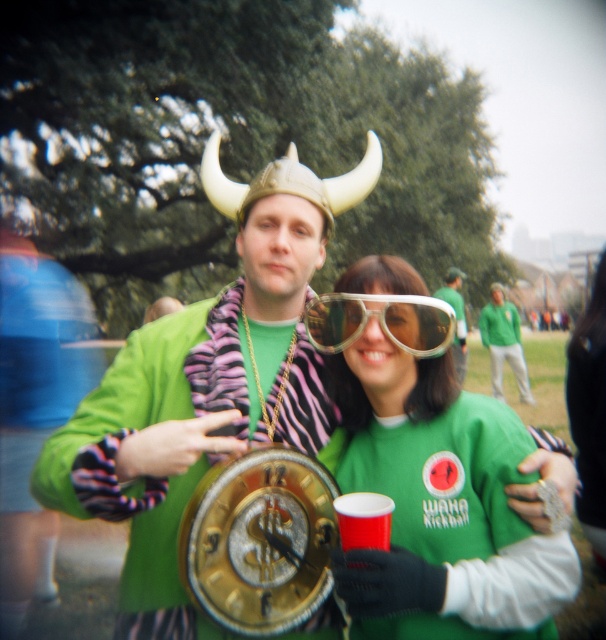
Question: Does clear plastic goggles at center appear on the left side of gold metallic clock at center?

Choices:
 (A) yes
 (B) no

Answer: (A)

Question: Which point is closer to the camera taking this photo?

Choices:
 (A) (439, 296)
 (B) (438, 348)
 (C) (355, 433)

Answer: (B)

Question: Which object is farther from the camera taking this photo?

Choices:
 (A) green matte shirt at center
 (B) gold metallic clock at center

Answer: (B)

Question: Is green matte shirt at center in front of gold metallic clock at center?

Choices:
 (A) yes
 (B) no

Answer: (A)

Question: Does green matte shirt at center have a larger size compared to clear plastic goggles at center?

Choices:
 (A) no
 (B) yes

Answer: (B)

Question: Which of the following is the farthest from the observer?

Choices:
 (A) clear plastic goggles at center
 (B) green matte shirt at center
 (C) gold metallic clock at center

Answer: (C)